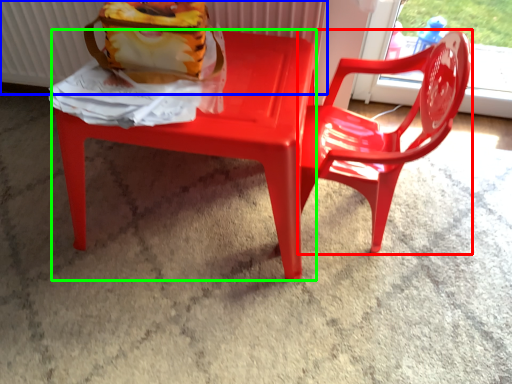
Question: Based on their relative distances, which object is nearer to chair (highlighted by a red box)? Choose from radiator (highlighted by a blue box) and chair (highlighted by a green box).

Choices:
 (A) radiator
 (B) chair

Answer: (B)